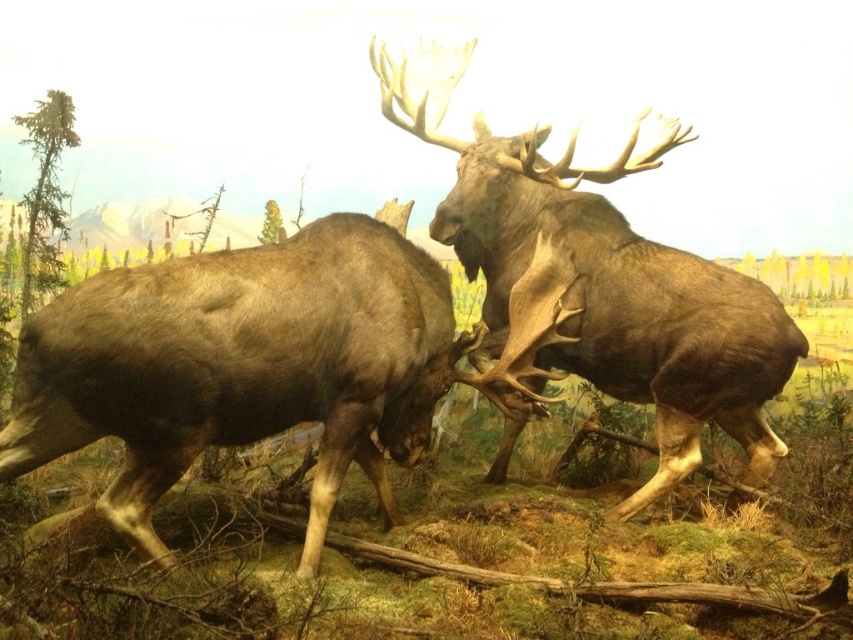
You are a wildlife photographer standing at the edge of the diorama. You want to capture a photo of the brown matte moose at center. Where should you aim your camera to ensure the moose is in the center of your photo?

You should aim your camera at the point corresponding to the coordinates provided in the description, which is at point (242, 365), to ensure the brown matte moose at center is centered in your photo.

You are a photographer standing at the camera position in the diorama scene. You want to capture a closeup shot of the point at coordinates point (329, 346). What is the minimum distance you need to move forward to reach that point?

The minimum distance you need to move forward to reach point (329, 346) is 10.58 feet, as the point is 10.58 feet away from the camera.

You are a wildlife photographer aiming to capture a clear photo of both the brown matte moose at center and the brown velvet moose at center. Since you want to focus on the one closer to you first, which moose should you adjust your camera settings for?

The brown matte moose at center is closer to the viewer than the brown velvet moose at center, so you should adjust your camera settings for the brown matte moose at center first.